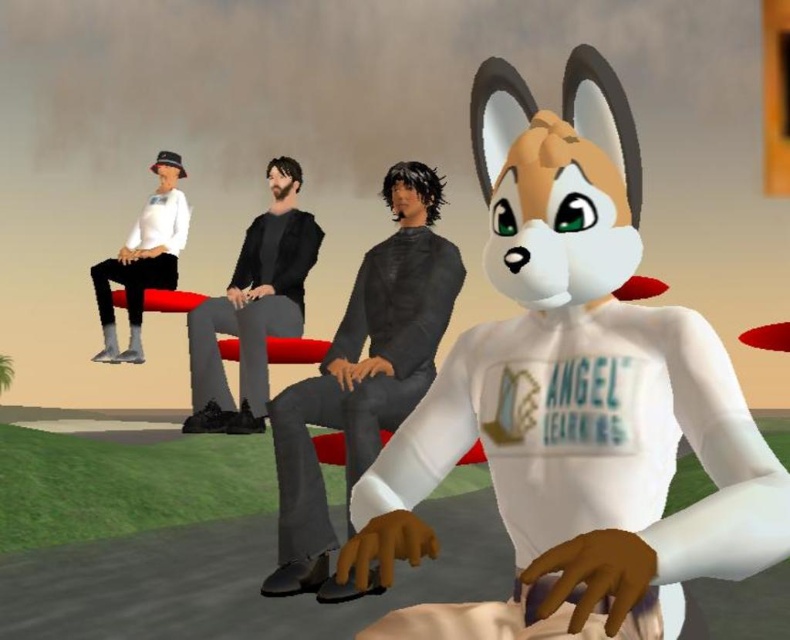
Consider the image. Does white matte plush at center have a greater width compared to white matte shirt at left?

Yes.

Which is more to the right, white matte plush at center or white matte shirt at left?

white matte plush at center

Is point (743, 403) farther from viewer compared to point (128, 246)?

No, it is not.

Where is `white matte plush at center`? Image resolution: width=790 pixels, height=640 pixels. white matte plush at center is located at coordinates (574, 397).

Between white matte plush at center and black matte pants at center, which one has less height?

Standing shorter between the two is white matte plush at center.

Can you confirm if white matte plush at center is shorter than black matte pants at center?

Indeed, white matte plush at center has a lesser height compared to black matte pants at center.

Does point (559, 392) come farther from viewer compared to point (275, 316)?

No.

Locate an element on the screen. white matte plush at center is located at coordinates tap(574, 397).

The height and width of the screenshot is (640, 790). Describe the element at coordinates (574, 397) in the screenshot. I see `white matte plush at center` at that location.

Is point (597, 538) positioned behind point (288, 392)?

No, it is not.

The height and width of the screenshot is (640, 790). What do you see at coordinates (574, 397) in the screenshot?
I see `white matte plush at center` at bounding box center [574, 397].

Identify the location of white matte plush at center. (574, 397).